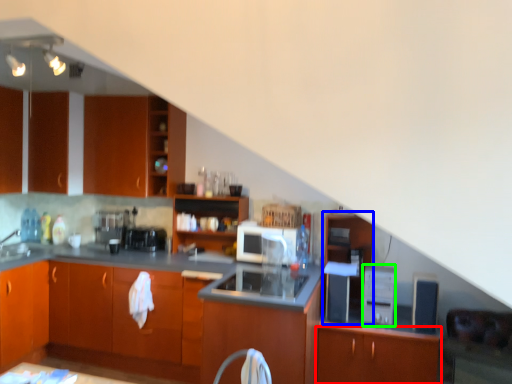
Question: Considering the real-world distances, which object is farthest from cabinetry (highlighted by a red box)? file cabinet (highlighted by a blue box) or appliance (highlighted by a green box)?

Choices:
 (A) file cabinet
 (B) appliance

Answer: (A)